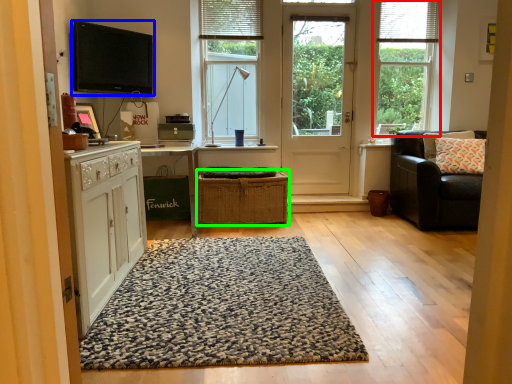
Question: Which is farther away from window (highlighted by a red box)? electronic (highlighted by a blue box) or crate (highlighted by a green box)?

Choices:
 (A) electronic
 (B) crate

Answer: (A)